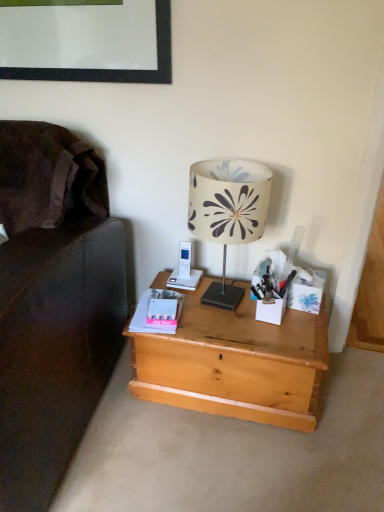
The height and width of the screenshot is (512, 384). What do you see at coordinates (235, 362) in the screenshot? I see `natural wood desk at center` at bounding box center [235, 362].

Identify the location of white fabric lampshade at center. (x=227, y=213).

Locate an element on the screen. This screenshot has width=384, height=512. matte pink paperback book at center-left is located at coordinates (146, 318).

Is natural wood desk at center taller than white matte box at right?

Indeed, natural wood desk at center has a greater height compared to white matte box at right.

Can you tell me how much natural wood desk at center and white matte box at right differ in facing direction?

The angular difference between natural wood desk at center and white matte box at right is 5.17 degrees.

Which is farther from the camera, (283,394) or (298,281)?

The point (298,281) is behind.

From a real-world perspective, is white matte box at right under natural wood desk at center?

No, from a real-world perspective, white matte box at right is not below natural wood desk at center.

In terms of height, does white matte box at right look taller or shorter compared to natural wood desk at center?

In the image, white matte box at right appears to be shorter than natural wood desk at center.

Is white matte box at right in front of natural wood desk at center?

No, it is behind natural wood desk at center.

Between white fabric lampshade at center and matte pink paperback book at center-left, which one is positioned behind?

matte pink paperback book at center-left is more distant.

From a real-world perspective, is white fabric lampshade at center located beneath matte pink paperback book at center-left?

No, from a real-world perspective, white fabric lampshade at center is not under matte pink paperback book at center-left.

Which is correct: white fabric lampshade at center is inside matte pink paperback book at center-left, or outside of it?

white fabric lampshade at center cannot be found inside matte pink paperback book at center-left.

Considering the relative positions of white fabric lampshade at center and matte pink paperback book at center-left in the image provided, is white fabric lampshade at center to the left or to the right of matte pink paperback book at center-left?

Based on their positions, white fabric lampshade at center is located to the right of matte pink paperback book at center-left.

In the image, there is a matte pink paperback book at center-left. Where is `desk below it (from the image's perspective)`? The width and height of the screenshot is (384, 512). desk below it (from the image's perspective) is located at coordinates (235, 362).

From the image's perspective, which one is positioned higher, matte pink paperback book at center-left or natural wood desk at center?

matte pink paperback book at center-left appears higher in the image.

Consider the image. Is matte pink paperback book at center-left in contact with natural wood desk at center?

No, matte pink paperback book at center-left is not beside natural wood desk at center.

In the scene shown: From a real-world perspective, is matte pink paperback book at center-left on top of natural wood desk at center?

Answer: Yes.

Which of these two, white matte box at right or white matte stationery at right, is bigger?

With larger size is white matte box at right.

The height and width of the screenshot is (512, 384). Identify the location of stationery in front of the white matte box at right. (271, 298).

Is white matte box at right situated inside white matte stationery at right or outside?

white matte box at right is not inside white matte stationery at right, it's outside.

From a real-world perspective, which object rests below the other?

white matte stationery at right is physically lower.

Which is nearer, (217, 202) or (300, 303)?

Point (217, 202) appears to be closer to the viewer than point (300, 303).

From a real-world perspective, which is physically below, white fabric lampshade at center or white matte box at right?

white matte box at right is physically lower.

Image resolution: width=384 pixels, height=512 pixels. I want to click on lamp on the left of the white matte box at right, so click(227, 213).

From a real-world perspective, between matte pink paperback book at center-left and white fabric lampshade at center, who is vertically lower?

matte pink paperback book at center-left.

How many degrees apart are the facing directions of matte pink paperback book at center-left and white fabric lampshade at center?

The angle between the facing direction of matte pink paperback book at center-left and the facing direction of white fabric lampshade at center is 14.5 degrees.

From the image's perspective, is matte pink paperback book at center-left under white fabric lampshade at center?

Yes.

Is matte pink paperback book at center-left turned away from white fabric lampshade at center?

matte pink paperback book at center-left is not turned away from white fabric lampshade at center.

The image size is (384, 512). Find the location of `box located above the natural wood desk at center (from a real-world perspective)`. box located above the natural wood desk at center (from a real-world perspective) is located at coordinates (307, 292).

Where is `desk that is below the white matte box at right (from the image's perspective)`? This screenshot has width=384, height=512. desk that is below the white matte box at right (from the image's perspective) is located at coordinates (235, 362).

Considering their positions, is white fabric lampshade at center positioned further to matte pink paperback book at center-left than natural wood desk at center?

white fabric lampshade at center is further to matte pink paperback book at center-left.

Estimate the real-world distances between objects in this image. Which object is closer to white fabric lampshade at center, natural wood desk at center or white matte box at right?

The object closer to white fabric lampshade at center is white matte box at right.

Based on their spatial positions, is white fabric lampshade at center or white matte stationery at right closer to matte pink paperback book at center-left?

The object closer to matte pink paperback book at center-left is white matte stationery at right.

Looking at the image, which one is located closer to natural wood desk at center, white fabric lampshade at center or matte pink paperback book at center-left?

Based on the image, matte pink paperback book at center-left appears to be nearer to natural wood desk at center.

Based on their spatial positions, is matte pink paperback book at center-left or natural wood desk at center further from white matte stationery at right?

matte pink paperback book at center-left.

Looking at this image, which object lies nearer to the anchor point matte pink paperback book at center-left, white matte box at right or white fabric lampshade at center?

white fabric lampshade at center is closer to matte pink paperback book at center-left.

Based on their spatial positions, is white fabric lampshade at center or natural wood desk at center closer to white matte stationery at right?

natural wood desk at center is positioned closer to the anchor white matte stationery at right.

Looking at the image, which one is located further to white fabric lampshade at center, white matte box at right or matte pink paperback book at center-left?

Among the two, matte pink paperback book at center-left is located further to white fabric lampshade at center.

At what (x,y) coordinates should I click in order to perform the action: click on box between white fabric lampshade at center and natural wood desk at center from top to bottom. Please return your answer as a coordinate pair (x, y). Looking at the image, I should click on (307, 292).

Locate an element on the screen. This screenshot has width=384, height=512. lamp between matte pink paperback book at center-left and white matte stationery at right in the horizontal direction is located at coordinates (227, 213).

Locate an element on the screen. stationery between natural wood desk at center and white matte box at right is located at coordinates (271, 298).

Locate an element on the screen. The width and height of the screenshot is (384, 512). desk situated between matte pink paperback book at center-left and white matte stationery at right from left to right is located at coordinates (235, 362).